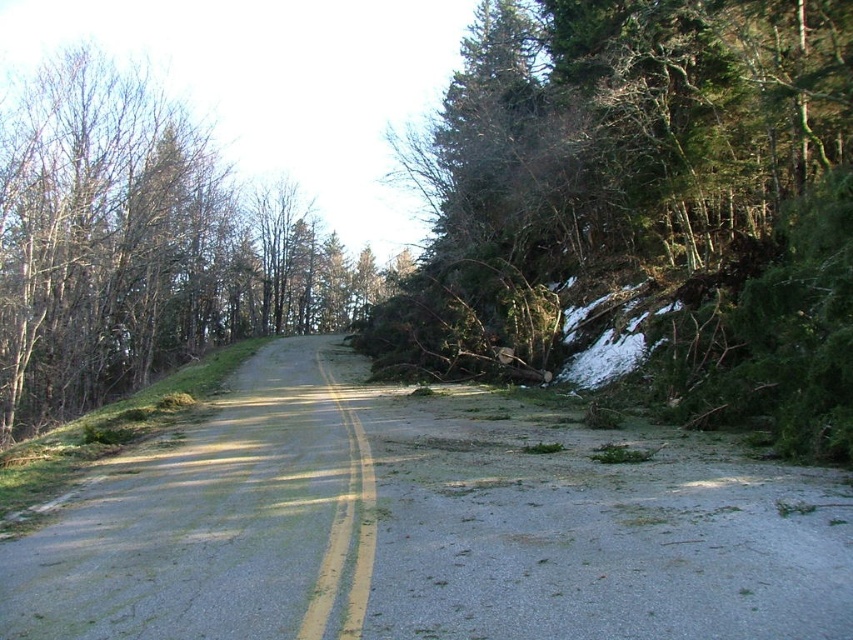
Question: Which point is farther to the camera?

Choices:
 (A) gray asphalt road at center
 (B) smooth asphalt road at center
 (C) green textured tree at right

Answer: (C)

Question: Can you confirm if green textured tree at right is positioned to the left of smooth asphalt road at center?

Choices:
 (A) no
 (B) yes

Answer: (A)

Question: Can you confirm if green textured tree at right is positioned below smooth asphalt road at center?

Choices:
 (A) no
 (B) yes

Answer: (A)

Question: Is gray asphalt road at center thinner than green leafy tree at left?

Choices:
 (A) yes
 (B) no

Answer: (A)

Question: Which point is farther from the camera taking this photo?

Choices:
 (A) (764, 211)
 (B) (4, 237)
 (C) (9, 552)

Answer: (B)

Question: Which object appears closest to the camera in this image?

Choices:
 (A) green leafy tree at left
 (B) gray asphalt road at center
 (C) green textured tree at right

Answer: (B)